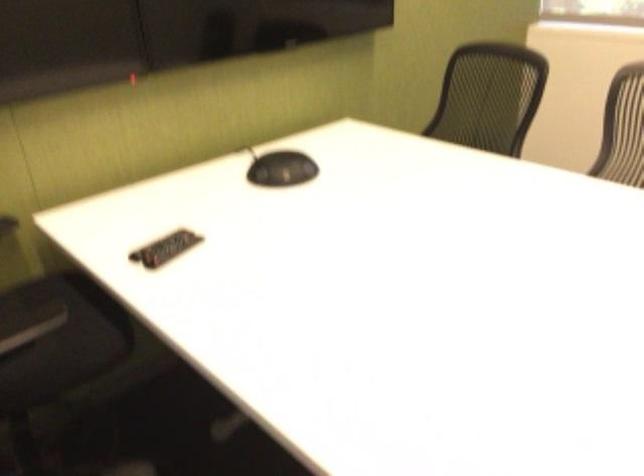
Which object does [165,248] point to?

It corresponds to the black remote control in the image.